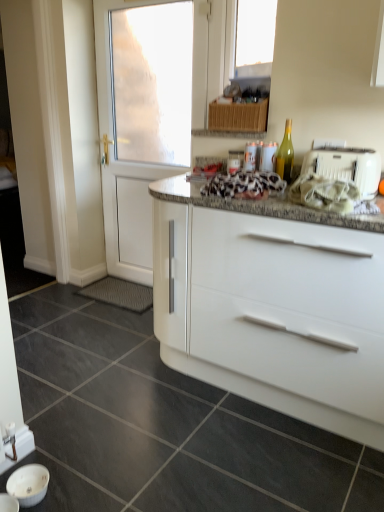
Question: From their relative heights in the image, would you say white glossy sink at lower left is taller or shorter than transparent glass window at upper center?

Choices:
 (A) tall
 (B) short

Answer: (B)

Question: From a real-world perspective, is white glossy sink at lower left above or below transparent glass window at upper center?

Choices:
 (A) above
 (B) below

Answer: (B)

Question: Estimate the real-world distances between objects in this image. Which object is closer to the transparent glass window at upper center?

Choices:
 (A) white glossy door at left
 (B) green glass bottle at upper right
 (C) white plastic toaster at right
 (D) white glossy sink at lower left
 (E) white glossy cabinet at center

Answer: (B)

Question: Based on their relative distances, which object is nearer to the white glossy sink at lower left?

Choices:
 (A) green glass bottle at upper right
 (B) white plastic toaster at right
 (C) white glossy cabinet at center
 (D) white glossy door at left
 (E) transparent glass window at upper center

Answer: (C)